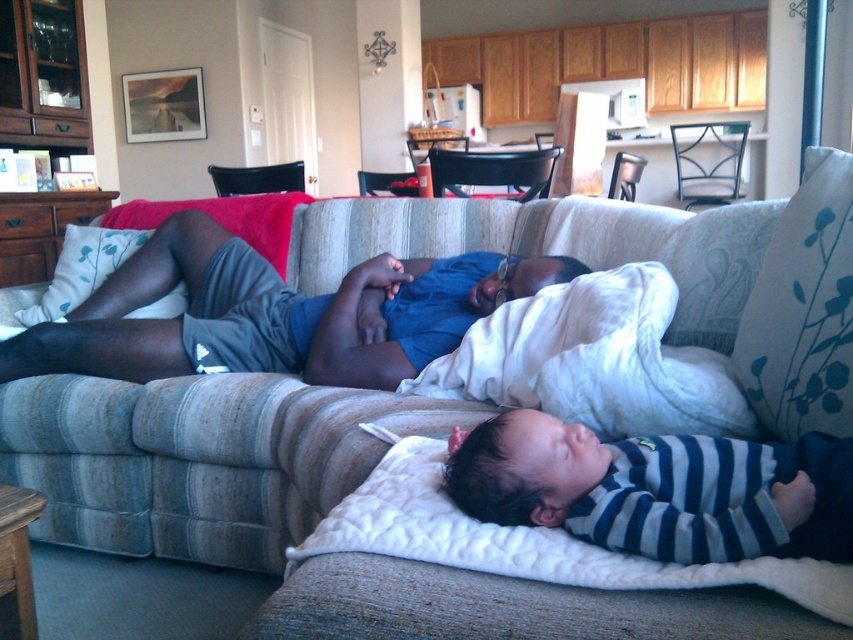
Can you confirm if striped cotton onesie at center is smaller than striped fabric baby at lower right?

Incorrect, striped cotton onesie at center is not smaller in size than striped fabric baby at lower right.

Can you confirm if striped cotton onesie at center is taller than striped fabric baby at lower right?

Correct, striped cotton onesie at center is much taller as striped fabric baby at lower right.

Between point (531, 289) and point (573, 525), which one is positioned in front?

Point (573, 525)

This screenshot has width=853, height=640. I want to click on striped cotton onesie at center, so click(x=273, y=314).

How much distance is there between striped cotton onesie at center and white plush blanket at lower center?

31.82 inches

Which is more to the right, striped cotton onesie at center or white plush blanket at lower center?

white plush blanket at lower center

This screenshot has height=640, width=853. What do you see at coordinates (273, 314) in the screenshot?
I see `striped cotton onesie at center` at bounding box center [273, 314].

At what (x,y) coordinates should I click in order to perform the action: click on striped cotton onesie at center. Please return your answer as a coordinate pair (x, y). This screenshot has height=640, width=853. Looking at the image, I should click on (273, 314).

Who is positioned more to the left, striped fabric baby at lower right or white plush blanket at lower center?

white plush blanket at lower center is more to the left.

Is striped fabric baby at lower right thinner than white plush blanket at lower center?

Correct, striped fabric baby at lower right's width is less than white plush blanket at lower center's.

The image size is (853, 640). Find the location of `striped fabric baby at lower right`. striped fabric baby at lower right is located at coordinates (659, 490).